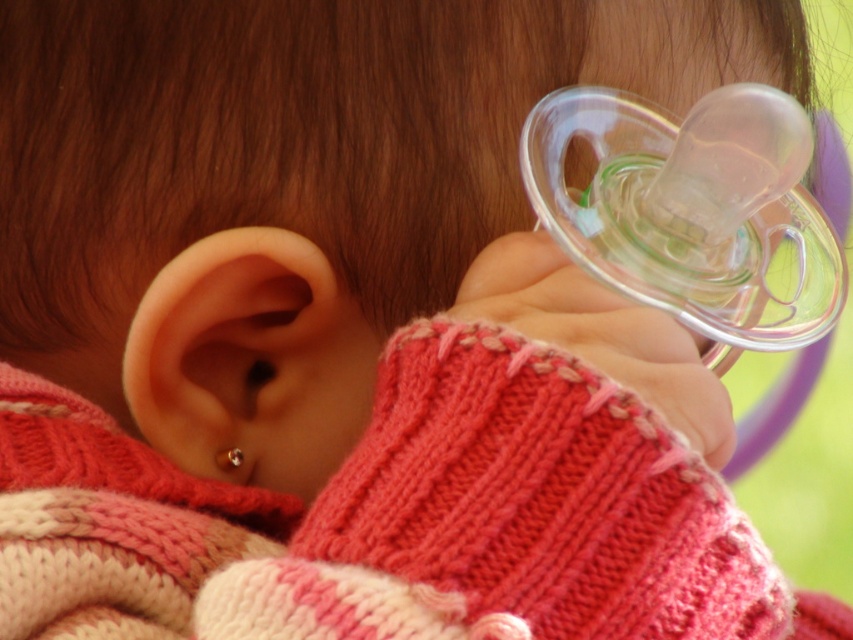
You are a photographer adjusting the focus on your camera. You want to ensure both the pearl earring at lower left and the clear plastic teething ring at ear are in focus. Given their sizes, which object should you adjust the focus on first to ensure both are sharp?

The pearl earring at lower left is much taller than the clear plastic teething ring at ear, so you should focus on the pearl earring at lower left first to ensure both are sharp.

What is the exact location of the pearl earring at lower left in the image?

The pearl earring at lower left is located at point (244, 358).